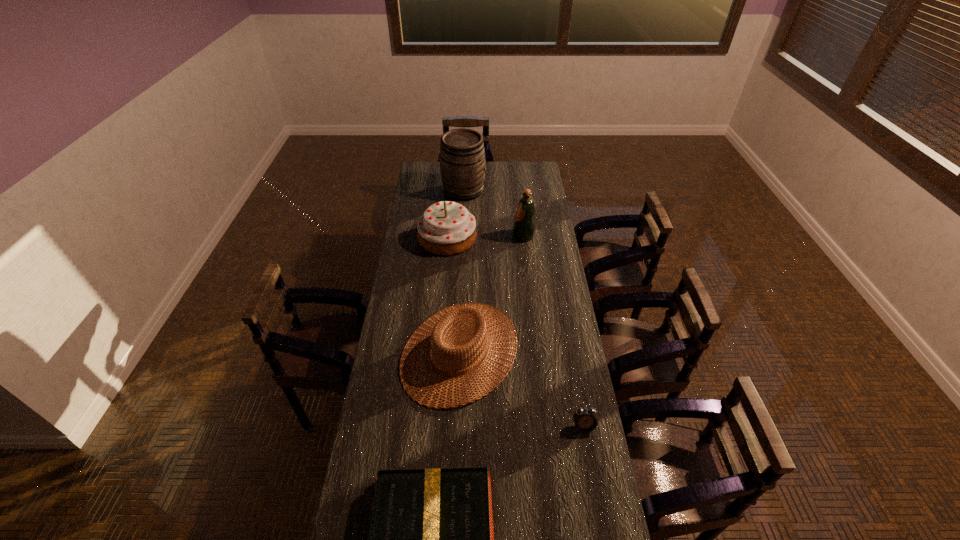
Identify which object is located as the second nearest to the fifth object from left to right. Please provide its 2D coordinates. Your answer should be formatted as a tuple, i.e. [(x, y)], where the tuple contains the x and y coordinates of a point satisfying the conditions above.

[(462, 156)]

You are a GUI agent. You are given a task and a screenshot of the screen. Output one action in this format:
    pyautogui.click(x=<x>, y=<y>)
    Task: Click on the object identified as the second closest to the fourth shortest object
    The image size is (960, 540).
    Given the screenshot: What is the action you would take?
    pyautogui.click(x=524, y=224)

At what (x,y) coordinates should I click in order to perform the action: click on vacant region that satisfies the following two spatial constraints: 1. on the back side of the wine bucket; 2. on the left side of the fourth shortest object. Please return your answer as a coordinate pair (x, y). The image size is (960, 540). Looking at the image, I should click on (451, 191).

Find the location of a particular element. This screenshot has width=960, height=540. vacant point that satisfies the following two spatial constraints: 1. on the front-facing side of the fifth object from left to right; 2. on the front side of the cake is located at coordinates (524, 238).

Find the location of a particular element. vacant region that satisfies the following two spatial constraints: 1. on the front-facing side of the olive oil; 2. on the front side of the cake is located at coordinates click(524, 238).